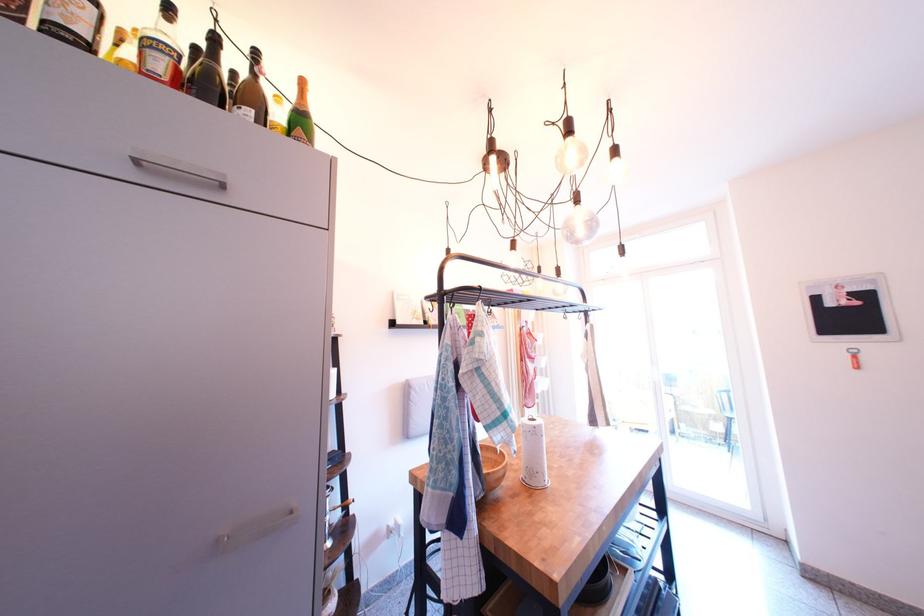
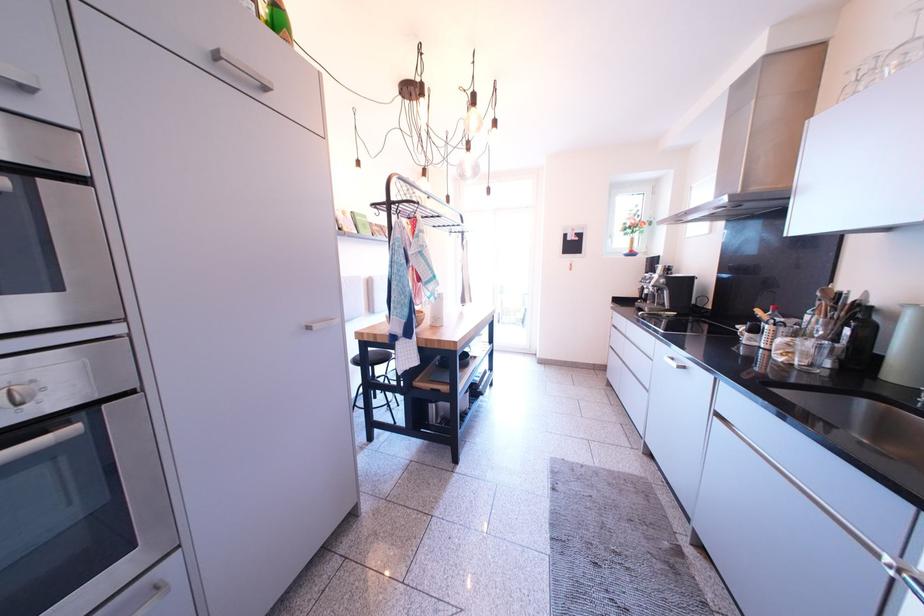
How did the camera likely rotate?

The rotation direction of the camera is right-down.